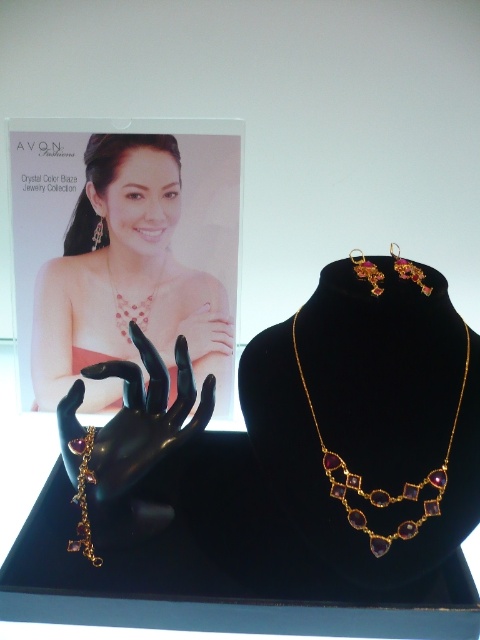
You are a customer at an Avon store and want to know if the shiny gold necklace at center and the gold textured earrings at upper right can be placed together in a gift box that has a maximum length of 14 inches. Can they fit? Please explain your reasoning based on their distance apart in the image.

The shiny gold necklace at center and gold textured earrings at upper right are 14.15 inches apart. Since the gift box can only accommodate items up to 14 inches in length, the 14.15 inch distance exceeds the limit. Therefore, they cannot be placed together in the box.

You are a customer at an Avon jewelry display. You see the shiny gold necklace at center and the gold textured earrings at upper right. Which one is positioned lower in the image?

The shiny gold necklace at center is positioned below the gold textured earrings at upper right, so the necklace is lower.

You are standing in front of the jewelry display. You want to know if the shiny gold necklace at center is within your reach. Your hand can extend 3 feet. Can you reach it?

The shiny gold necklace at center is 3.42 feet away from the viewer, which is slightly beyond your hand extension of 3 feet. Therefore, you cannot reach it.